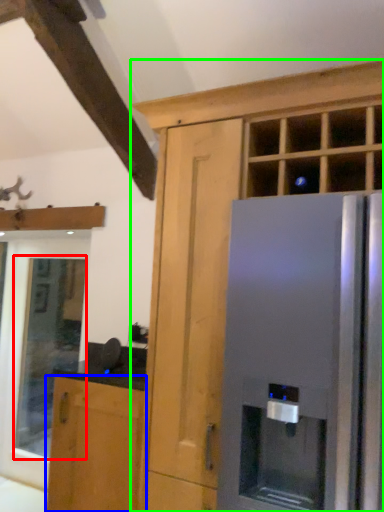
Question: Which object is positioned farthest from window (highlighted by a red box)? Select from cabinetry (highlighted by a blue box) and cabinetry (highlighted by a green box).

Choices:
 (A) cabinetry
 (B) cabinetry

Answer: (B)